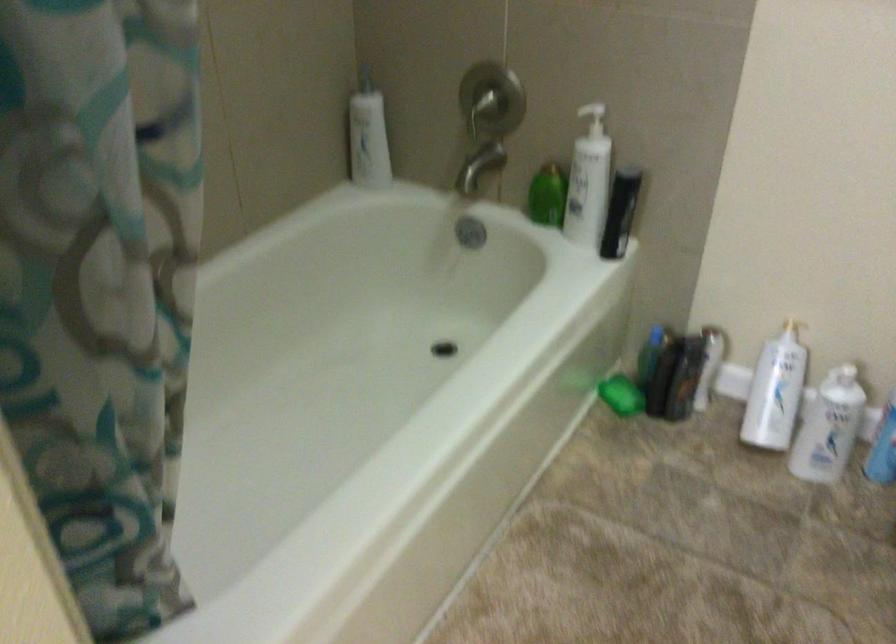
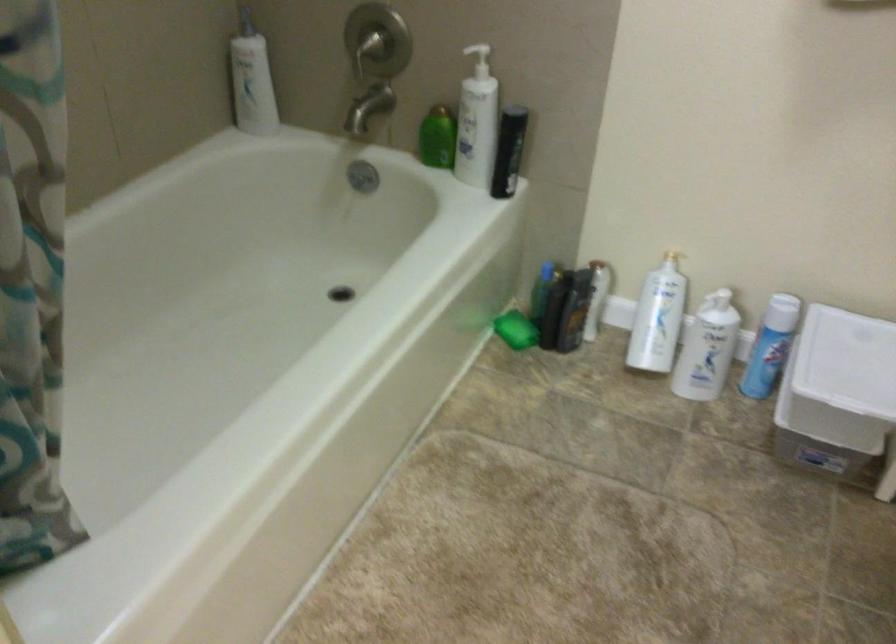
The point at (622, 395) is marked in the first image. Where is the corresponding point in the second image?

(515, 328)